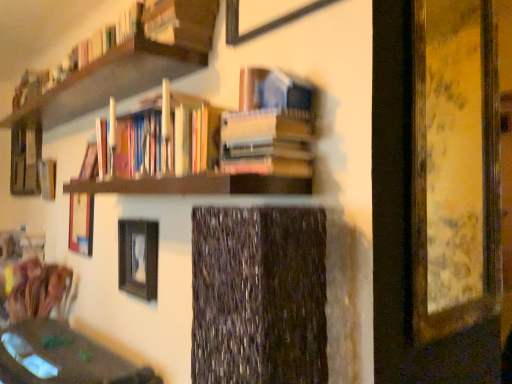
Question: Should I look upward or downward to see wooden bookshelf at upper left, which is the 3th book in bottom-to-top order?

Choices:
 (A) down
 (B) up

Answer: (B)

Question: From a real-world perspective, is hardcover book at center, marked as the 3th book in a top-to-bottom arrangement, positioned over wooden picture frame at center, which ranks as the 4th picture frame in right-to-left order, based on gravity?

Choices:
 (A) yes
 (B) no

Answer: (A)

Question: From the image's perspective, is hardcover book at center, which appears as the first book when ordered from the bottom, below wooden picture frame at center, which ranks as the first picture frame in left-to-right order?

Choices:
 (A) no
 (B) yes

Answer: (A)

Question: Does hardcover book at center, which appears as the first book when ordered from the bottom, have a larger size compared to wooden picture frame at center, the 1th picture frame when ordered from back to front?

Choices:
 (A) yes
 (B) no

Answer: (A)

Question: Could you tell me if hardcover book at center, which appears as the first book when ordered from the bottom, is turned towards wooden picture frame at center, the 1th picture frame when ordered from back to front?

Choices:
 (A) no
 (B) yes

Answer: (A)

Question: Is wooden picture frame at center, the 1th picture frame when ordered from back to front, at the back of hardcover book at center, marked as the 3th book in a top-to-bottom arrangement?

Choices:
 (A) no
 (B) yes

Answer: (A)

Question: Is hardcover book at center, which appears as the first book when ordered from the bottom, touching wooden picture frame at center, which ranks as the first picture frame in left-to-right order?

Choices:
 (A) yes
 (B) no

Answer: (B)

Question: Is wooden bookshelf at left located outside matte brown table at lower left?

Choices:
 (A) yes
 (B) no

Answer: (A)

Question: Is the position of wooden bookshelf at left more distant than that of matte brown table at lower left?

Choices:
 (A) yes
 (B) no

Answer: (A)

Question: Is wooden bookshelf at left wider than matte brown table at lower left?

Choices:
 (A) yes
 (B) no

Answer: (B)

Question: Is the depth of wooden bookshelf at left less than that of matte brown table at lower left?

Choices:
 (A) no
 (B) yes

Answer: (A)

Question: From the image's perspective, is wooden bookshelf at left beneath matte brown table at lower left?

Choices:
 (A) no
 (B) yes

Answer: (A)

Question: Does wooden bookshelf at left appear on the right side of matte brown table at lower left?

Choices:
 (A) no
 (B) yes

Answer: (A)

Question: Considering the relative sizes of matte black picture frame at center, which is counted as the second picture frame, starting from the back, and matte brown table at lower left in the image provided, is matte black picture frame at center, which is counted as the second picture frame, starting from the back, shorter than matte brown table at lower left?

Choices:
 (A) yes
 (B) no

Answer: (A)